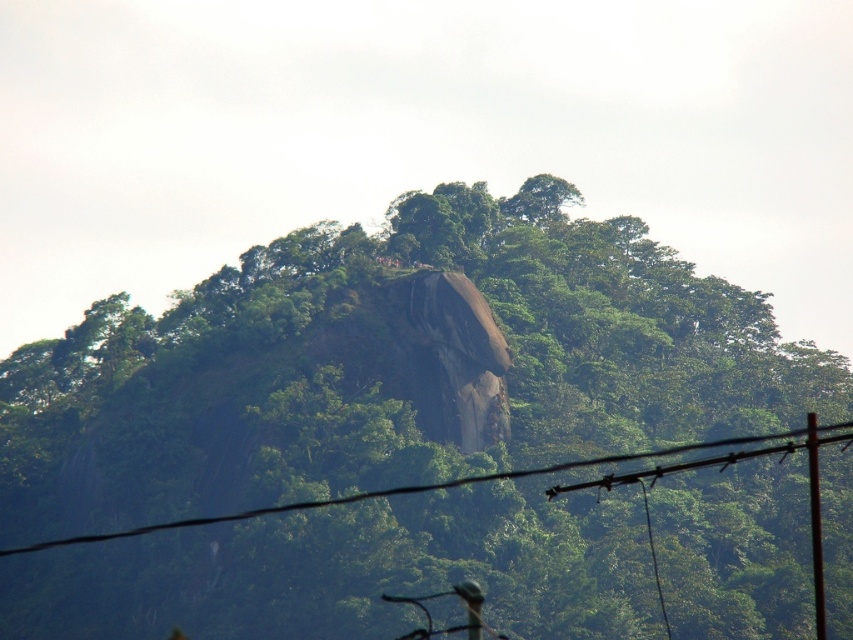
Question: Is green leafy tree at center bigger than black wire at center?

Choices:
 (A) no
 (B) yes

Answer: (B)

Question: Which object appears farthest from the camera in this image?

Choices:
 (A) black wire at center
 (B) green leafy tree at center

Answer: (B)

Question: Among these points, which one is farthest from the camera?

Choices:
 (A) (231, 353)
 (B) (663, 454)

Answer: (A)

Question: Is green leafy tree at center smaller than black wire at center?

Choices:
 (A) yes
 (B) no

Answer: (B)

Question: Which object appears farthest from the camera in this image?

Choices:
 (A) green leafy tree at center
 (B) black wire at center

Answer: (A)

Question: Can you confirm if green leafy tree at center is positioned to the right of black wire at center?

Choices:
 (A) yes
 (B) no

Answer: (B)